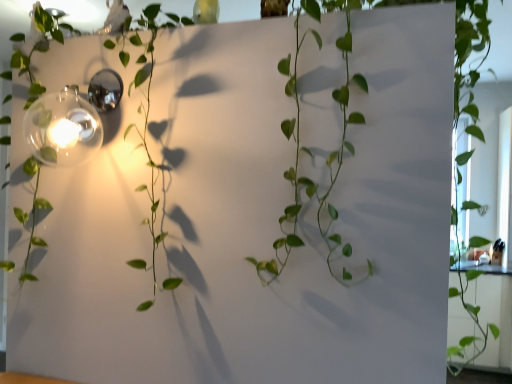
This screenshot has width=512, height=384. Describe the element at coordinates (63, 128) in the screenshot. I see `polished chrome light fixture at upper left` at that location.

This screenshot has height=384, width=512. I want to click on polished chrome light fixture at upper left, so click(63, 128).

Identify the location of polished chrome light fixture at upper left. (63, 128).